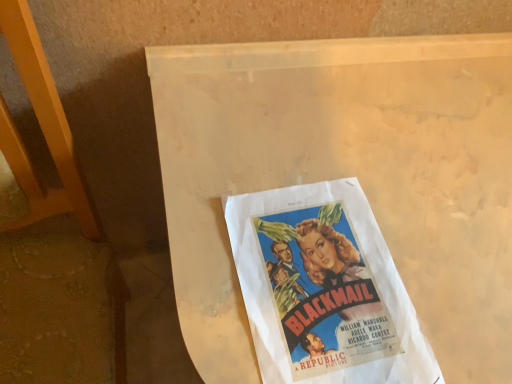
This screenshot has width=512, height=384. What do you see at coordinates (324, 289) in the screenshot?
I see `vintage paper poster at center` at bounding box center [324, 289].

Find the location of a particular element. The width and height of the screenshot is (512, 384). vintage paper poster at center is located at coordinates (324, 289).

What is the approximate width of vintage paper poster at center?

vintage paper poster at center is 11.78 inches wide.

What do you see at coordinates (346, 176) in the screenshot? The height and width of the screenshot is (384, 512). I see `white matte paper at center` at bounding box center [346, 176].

Where is `white matte paper at center`? The height and width of the screenshot is (384, 512). white matte paper at center is located at coordinates (346, 176).

What are the coordinates of `vintage paper poster at center` in the screenshot? It's located at coord(324,289).

Looking at this image, in the image, is white matte paper at center on the left side or the right side of vintage paper poster at center?

white matte paper at center is positioned on vintage paper poster at center's right side.

Which is in front, white matte paper at center or vintage paper poster at center?

white matte paper at center is in front.

Is point (288, 112) behind point (358, 269)?

That is True.

From the image's perspective, between white matte paper at center and vintage paper poster at center, which one is located above?

vintage paper poster at center, from the image's perspective.

From a real-world perspective, is white matte paper at center beneath vintage paper poster at center?

Yes, from a real-world perspective, white matte paper at center is below vintage paper poster at center.

Which of these two, white matte paper at center or vintage paper poster at center, is wider?

white matte paper at center.

Is white matte paper at center shorter than vintage paper poster at center?

No.

Can you confirm if white matte paper at center is bigger than vintage paper poster at center?

Yes, white matte paper at center is bigger than vintage paper poster at center.

Can vintage paper poster at center be found inside white matte paper at center?

Yes, vintage paper poster at center is inside white matte paper at center.

Is white matte paper at center next to vintage paper poster at center?

white matte paper at center and vintage paper poster at center are clearly separated.

Is white matte paper at center positioned with its back to vintage paper poster at center?

That's not correct — white matte paper at center is not looking away from vintage paper poster at center.

What's the angular difference between white matte paper at center and vintage paper poster at center's facing directions?

The angular difference between white matte paper at center and vintage paper poster at center is 2.32 degrees.

Locate an element on the screen. This screenshot has width=512, height=384. poster above the white matte paper at center (from a real-world perspective) is located at coordinates click(x=324, y=289).

Which object is positioned more to the left, vintage paper poster at center or white matte paper at center?

vintage paper poster at center.

Between vintage paper poster at center and white matte paper at center, which one is positioned in front?

Positioned in front is white matte paper at center.

Is point (309, 233) positioned after point (315, 175)?

No, (309, 233) is closer to viewer.

From the image's perspective, which is below, vintage paper poster at center or white matte paper at center?

From the image's view, white matte paper at center is below.

Based on the photo, from a real-world perspective, does vintage paper poster at center sit lower than white matte paper at center?

No.

Based on the photo, considering the relative sizes of vintage paper poster at center and white matte paper at center in the image provided, is vintage paper poster at center thinner than white matte paper at center?

Indeed, vintage paper poster at center has a lesser width compared to white matte paper at center.

Is vintage paper poster at center taller than white matte paper at center?

No.

Is vintage paper poster at center bigger than white matte paper at center?

No.

Is vintage paper poster at center outside of white matte paper at center?

That's incorrect, vintage paper poster at center is not completely outside white matte paper at center.

Is vintage paper poster at center directly adjacent to white matte paper at center?

No, vintage paper poster at center is not in contact with white matte paper at center.

Is vintage paper poster at center positioned with its back to white matte paper at center?

That's right, vintage paper poster at center is facing away from white matte paper at center.

Identify the location of table that appears below the vintage paper poster at center (from a real-world perspective). (346, 176).

Where is `poster that is on the left side of white matte paper at center`? Image resolution: width=512 pixels, height=384 pixels. poster that is on the left side of white matte paper at center is located at coordinates (324, 289).

Locate an element on the screen. poster behind the white matte paper at center is located at coordinates (324, 289).